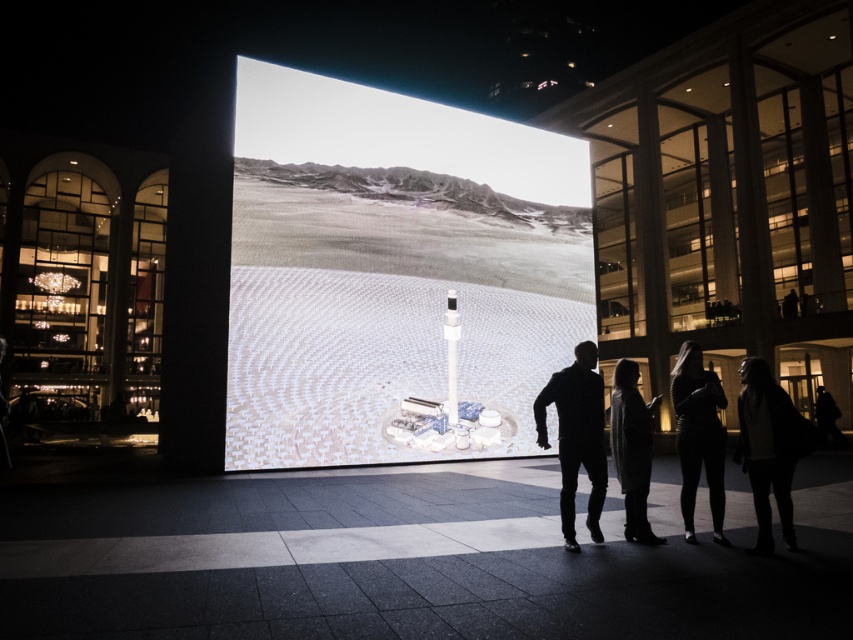
Based on the photo, you are standing in front of the large projection screen and want to take a photo of the silhouette clothing at center and the dark gray sweater at lower right. Which one will appear larger in your photo?

The silhouette clothing at center appears larger in the photo because it is closer to the viewer than the dark gray sweater at lower right.

You are standing at the projection screen and want to find the black leather jacket at lower right. Which direction should you look to locate the point at coordinate (698,436) on the black leather jacket at lower right?

The point at coordinate (698,436) is located on the black leather jacket at lower right, so you should look towards the lower right direction to find it.

You are at an outdoor event and see the dark gray sweater at lower right and the white glossy rectangular pillar at center. Which object is located to the right of the other?

The dark gray sweater at lower right is positioned on the right side of white glossy rectangular pillar at center.